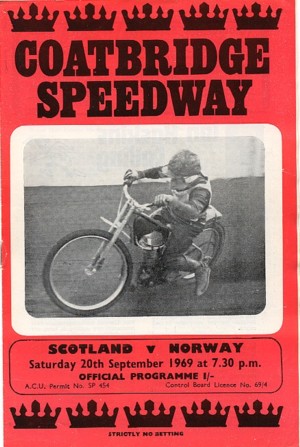
You are a GUI agent. You are given a task and a screenshot of the screen. Output one action in this format:
    pyautogui.click(x=<x>, y=<y>)
    Task: Click on the white border around picture
    
    Given the screenshot: What is the action you would take?
    pyautogui.click(x=26, y=132), pyautogui.click(x=269, y=128), pyautogui.click(x=275, y=221), pyautogui.click(x=270, y=317), pyautogui.click(x=153, y=326), pyautogui.click(x=21, y=327), pyautogui.click(x=18, y=229)